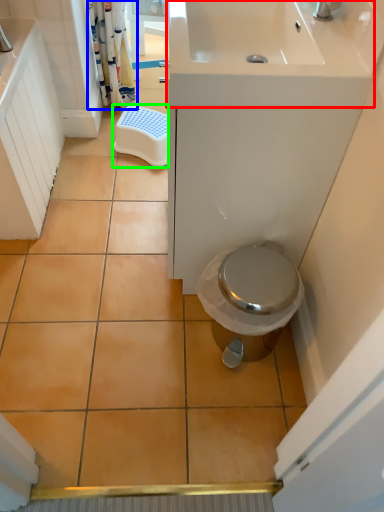
Question: Estimate the real-world distances between objects in this image. Which object is closer to sink (highlighted by a red box), shower curtain (highlighted by a blue box) or step stool (highlighted by a green box)?

Choices:
 (A) shower curtain
 (B) step stool

Answer: (B)